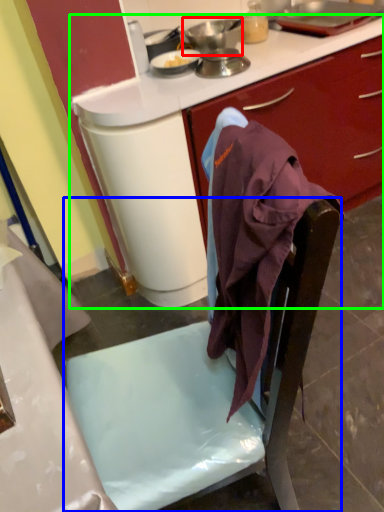
Question: Estimate the real-world distances between objects in this image. Which object is closer to kitchen appliance (highlighted by a red box), chair (highlighted by a blue box) or desk (highlighted by a green box)?

Choices:
 (A) chair
 (B) desk

Answer: (B)